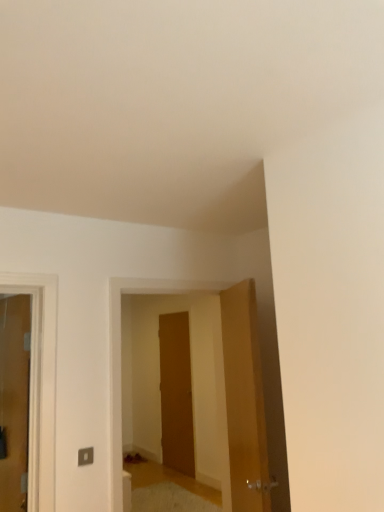
Question: Can you confirm if matte wooden door at left, positioned as the 1th door in left-to-right order, is positioned to the left of wooden door at center?

Choices:
 (A) yes
 (B) no

Answer: (A)

Question: From the image's perspective, is matte wooden door at left, the second door positioned from the back, over wooden door at center?

Choices:
 (A) yes
 (B) no

Answer: (A)

Question: Considering the relative positions of matte wooden door at left, the second door positioned from the back, and wooden door at center in the image provided, is matte wooden door at left, the second door positioned from the back, behind wooden door at center?

Choices:
 (A) no
 (B) yes

Answer: (A)

Question: Does matte wooden door at left, which is the third door in right-to-left order, have a larger size compared to wooden door at center?

Choices:
 (A) yes
 (B) no

Answer: (B)

Question: From a real-world perspective, does matte wooden door at left, positioned as the 1th door in left-to-right order, stand above wooden door at center?

Choices:
 (A) no
 (B) yes

Answer: (B)

Question: From the image's perspective, is wooden door at center above matte wooden door at left, positioned as the second door in front-to-back order?

Choices:
 (A) yes
 (B) no

Answer: (B)

Question: Does wooden door at center have a lesser height compared to matte wooden door at left, positioned as the second door in front-to-back order?

Choices:
 (A) no
 (B) yes

Answer: (A)

Question: Can you confirm if wooden door at center is bigger than matte wooden door at left, positioned as the second door in front-to-back order?

Choices:
 (A) no
 (B) yes

Answer: (B)

Question: Considering the relative positions of wooden door at center and matte wooden door at left, the second door positioned from the back, in the image provided, is wooden door at center to the right of matte wooden door at left, the second door positioned from the back, from the viewer's perspective?

Choices:
 (A) yes
 (B) no

Answer: (A)

Question: Is matte wooden door at left, positioned as the 1th door in left-to-right order, surrounded by wooden door at center?

Choices:
 (A) yes
 (B) no

Answer: (B)

Question: Is wooden door at center positioned beyond the bounds of matte wooden door at left, positioned as the 1th door in left-to-right order?

Choices:
 (A) no
 (B) yes

Answer: (B)

Question: Is matte wooden door at left, positioned as the 1th door in left-to-right order, positioned before wooden door at center, the 1th door positioned from the back?

Choices:
 (A) yes
 (B) no

Answer: (A)